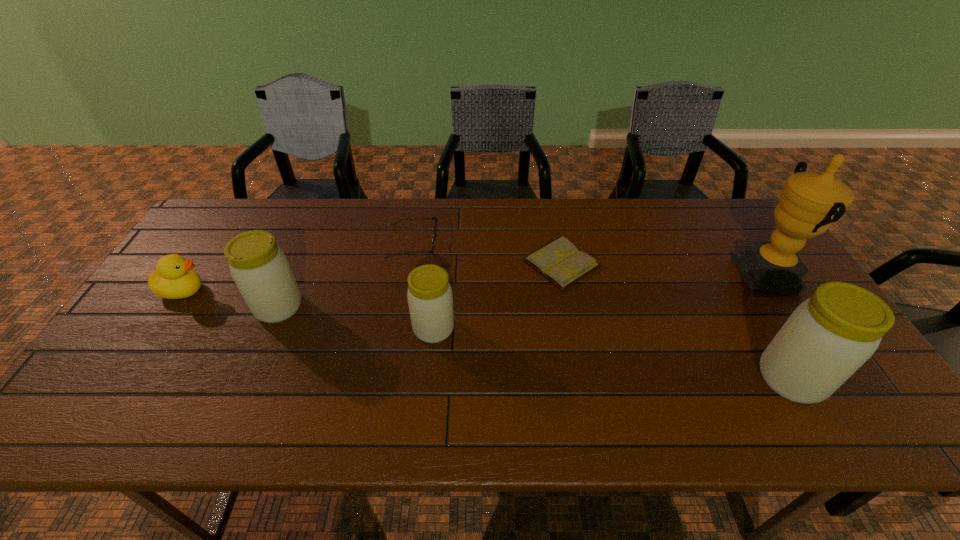
In the image, there is a desktop. At what (x,y) coordinates should I click in order to perform the action: click on vacant area at the far left corner. Please return your answer as a coordinate pair (x, y). This screenshot has width=960, height=540. Looking at the image, I should click on (197, 234).

I want to click on free space at the far right corner of the desktop, so click(729, 238).

I want to click on empty space between the leftmost object and the fourth shortest object, so click(x=308, y=309).

Locate an element on the screen. free point between the award and the fourth tallest object is located at coordinates (600, 301).

At what (x,y) coordinates should I click in order to perform the action: click on free space between the fourth shortest object and the award. Please return your answer as a coordinate pair (x, y). Looking at the image, I should click on (600, 301).

Find the location of a particular element. The image size is (960, 540). free point between the leftmost jar and the sixth tallest object is located at coordinates (346, 275).

The height and width of the screenshot is (540, 960). Find the location of `free space that is in between the shortest jar and the second tallest jar`. free space that is in between the shortest jar and the second tallest jar is located at coordinates (356, 318).

This screenshot has width=960, height=540. I want to click on unoccupied area between the fifth tallest object and the sixth tallest object, so click(x=298, y=266).

At what (x,y) coordinates should I click in order to perform the action: click on vacant area between the second shortest jar and the tallest object. Please return your answer as a coordinate pair (x, y). Looking at the image, I should click on (522, 291).

The image size is (960, 540). What are the coordinates of `unoccupied area between the duck and the fourth shortest object` in the screenshot? It's located at (308, 309).